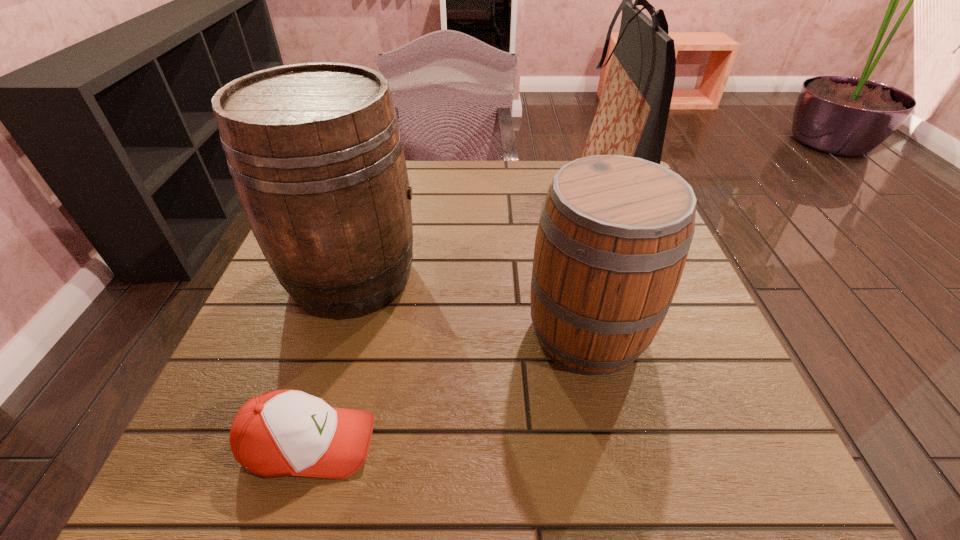
I want to click on the farthest object, so click(x=631, y=118).

Locate an element on the screen. the third shortest object is located at coordinates (316, 155).

Find the location of `the left cider`. the left cider is located at coordinates 316,155.

Where is `the second shortest object`? Image resolution: width=960 pixels, height=540 pixels. the second shortest object is located at coordinates (614, 233).

Where is `the shorter cider`? The height and width of the screenshot is (540, 960). the shorter cider is located at coordinates (614, 233).

The height and width of the screenshot is (540, 960). I want to click on baseball cap, so click(280, 433).

You are a GUI agent. You are given a task and a screenshot of the screen. Output one action in this format:
    pyautogui.click(x=<x>, y=<y>)
    Task: Click on the shortest object
    This screenshot has height=540, width=960.
    Given the screenshot: What is the action you would take?
    pyautogui.click(x=280, y=433)

At what (x,y) coordinates should I click in order to perform the action: click on free location located 0.380m on the front-facing side of the shopping bag. Please return your answer as a coordinate pair (x, y). Looking at the image, I should click on (419, 192).

Where is `vacant space located on the front-facing side of the shopping bag`? The height and width of the screenshot is (540, 960). vacant space located on the front-facing side of the shopping bag is located at coordinates (529, 192).

Image resolution: width=960 pixels, height=540 pixels. What are the coordinates of `vacant region located 0.240m on the front-facing side of the shopping bag` in the screenshot? It's located at (476, 192).